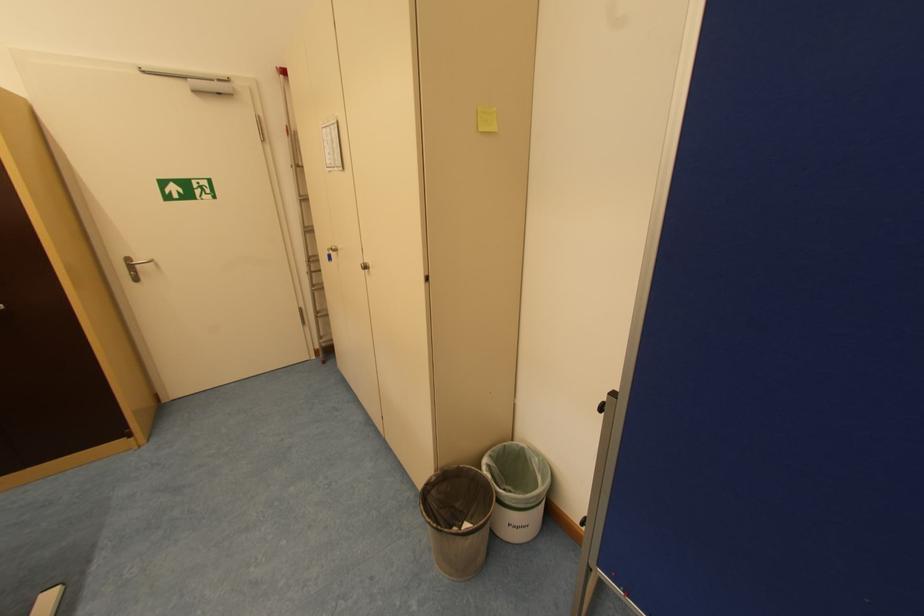
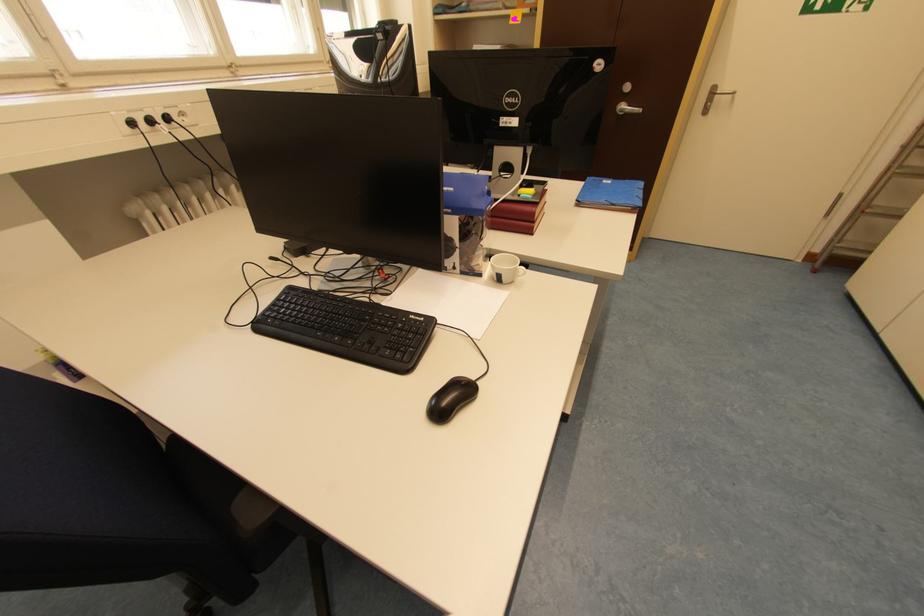
The images are taken continuously from a first-person perspective. In which direction is your viewpoint rotating?

The rotation direction of the camera is left-down.